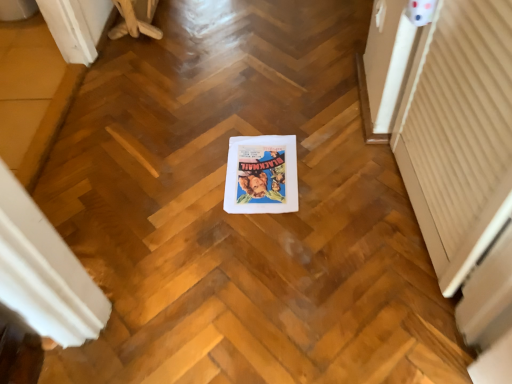
This screenshot has height=384, width=512. What do you see at coordinates (261, 175) in the screenshot?
I see `white paper at center` at bounding box center [261, 175].

Find the location of `white paper at center`. white paper at center is located at coordinates (261, 175).

Locate an element on the screen. This screenshot has height=384, width=512. white paper at center is located at coordinates (261, 175).